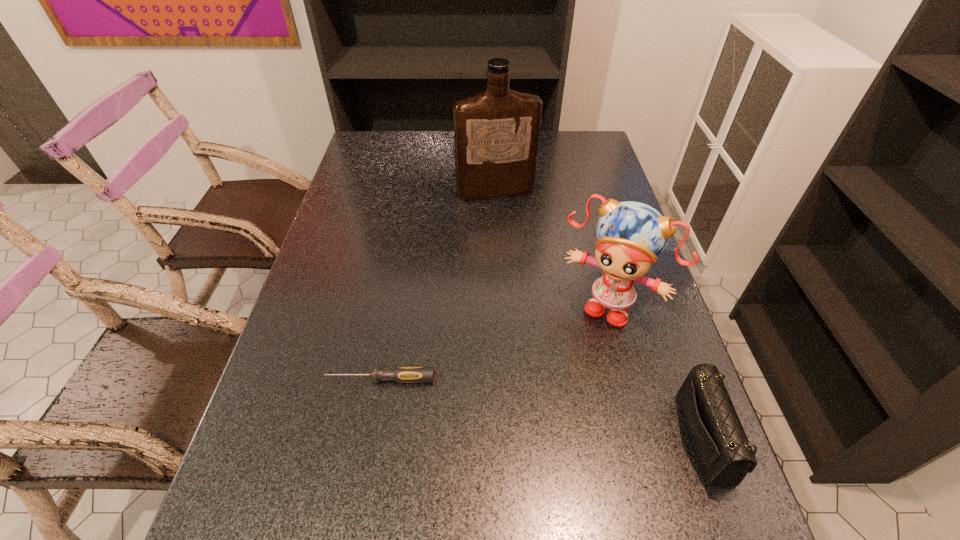
In order to click on free space between the doll and the third tallest object in this screenshot , I will do `click(660, 372)`.

Find the location of a particular element. The width and height of the screenshot is (960, 540). free point between the leftmost object and the second shortest object is located at coordinates (545, 408).

Locate an element on the screen. This screenshot has width=960, height=540. free space between the third object from right to left and the screwdriver is located at coordinates (438, 286).

I want to click on free spot between the third object from right to left and the clutch bag, so click(x=603, y=315).

Where is `empty space that is in between the third farthest object and the doll`? The image size is (960, 540). empty space that is in between the third farthest object and the doll is located at coordinates (495, 342).

Find the location of a particular element. The width and height of the screenshot is (960, 540). vacant point located between the second object from left to right and the doll is located at coordinates tap(553, 248).

Select which object appears as the second closest to the screwdriver. Please provide its 2D coordinates. Your answer should be formatted as a tuple, i.e. [(x, y)], where the tuple contains the x and y coordinates of a point satisfying the conditions above.

[(724, 453)]

Point out which object is positioned as the second nearest to the shortest object. Please provide its 2D coordinates. Your answer should be formatted as a tuple, i.e. [(x, y)], where the tuple contains the x and y coordinates of a point satisfying the conditions above.

[(724, 453)]

This screenshot has width=960, height=540. Identify the location of free region that satisfies the following two spatial constraints: 1. on the front side of the second shortest object; 2. on the front flap of the liquor. (506, 438).

Locate an element on the screen. The height and width of the screenshot is (540, 960). vacant space that satisfies the following two spatial constraints: 1. on the front side of the doll; 2. on the front flap of the third tallest object is located at coordinates click(645, 438).